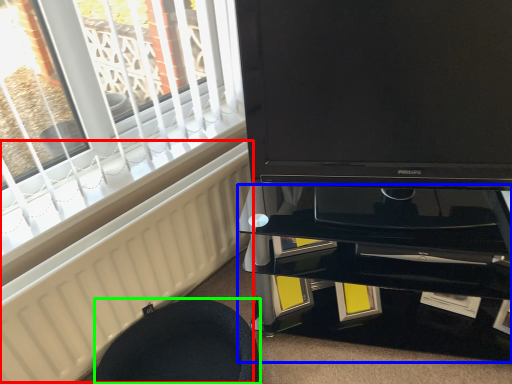
Question: Which is farther away from radiator (highlighted by a red box)? tv cabinet (highlighted by a blue box) or furniture (highlighted by a green box)?

Choices:
 (A) tv cabinet
 (B) furniture

Answer: (A)